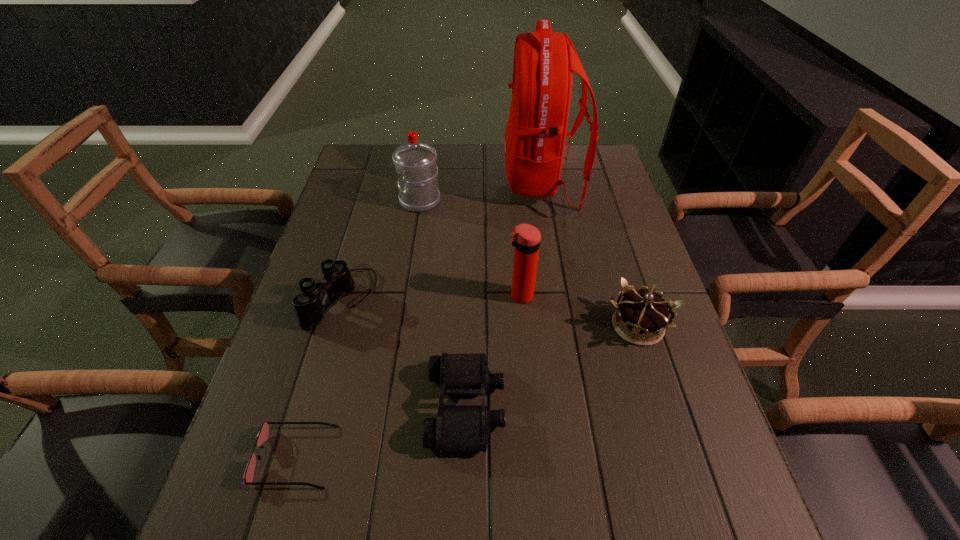
You are a GUI agent. You are given a task and a screenshot of the screen. Output one action in this format:
    pyautogui.click(x=<x>, y=<y>)
    Task: Click on the vacant space located on the main compartment of the backpack
    
    Given the screenshot: What is the action you would take?
    pyautogui.click(x=488, y=183)

In order to click on free space located 0.130m on the main compartment of the backpack in this screenshot , I will do pyautogui.click(x=464, y=183).

You are a GUI agent. You are given a task and a screenshot of the screen. Output one action in this format:
    pyautogui.click(x=<x>, y=<y>)
    Task: Click on the vacant space situated 0.160m on the handle side of the fifth object from right to left
    Image resolution: width=960 pixels, height=540 pixels.
    Given the screenshot: What is the action you would take?
    pyautogui.click(x=348, y=201)

The width and height of the screenshot is (960, 540). Find the location of `free space located on the front of the thermos bottle`. free space located on the front of the thermos bottle is located at coordinates (528, 388).

At what (x,y) coordinates should I click in order to perform the action: click on free space located 0.300m on the back of the left binoculars. Please return your answer as a coordinate pair (x, y). This screenshot has height=540, width=960. Looking at the image, I should click on (371, 199).

The image size is (960, 540). I want to click on vacant region located 0.090m on the left of the crown, so click(564, 326).

Where is `vacant region located 0.130m through the eyepieces of the right binoculars`? vacant region located 0.130m through the eyepieces of the right binoculars is located at coordinates (568, 407).

This screenshot has width=960, height=540. I want to click on vacant space positioned 0.200m on the bridge of the shortest object, so 441,457.

Where is `object that is at the far edge`? object that is at the far edge is located at coordinates (544, 61).

Identify the location of binoculars situated at the left edge. The image size is (960, 540). (338, 282).